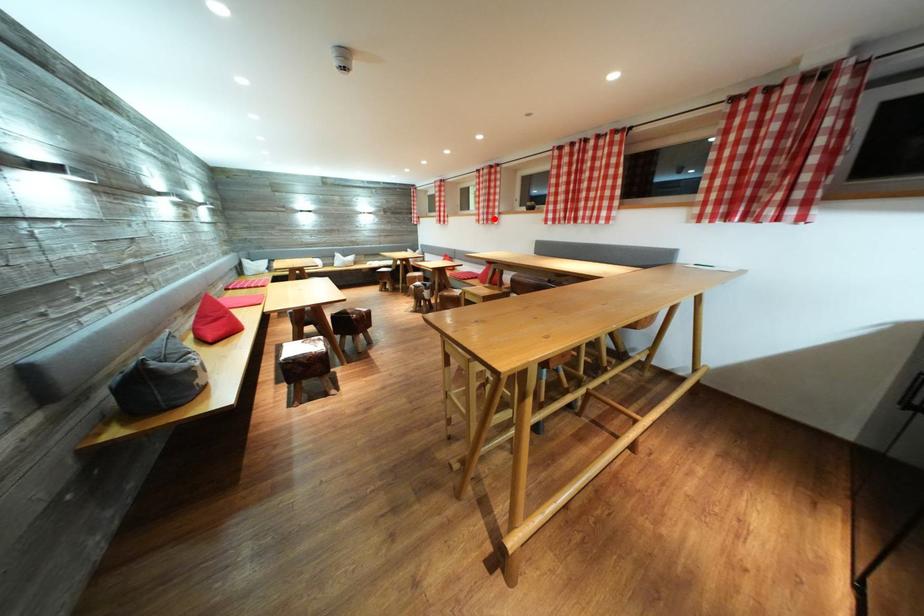
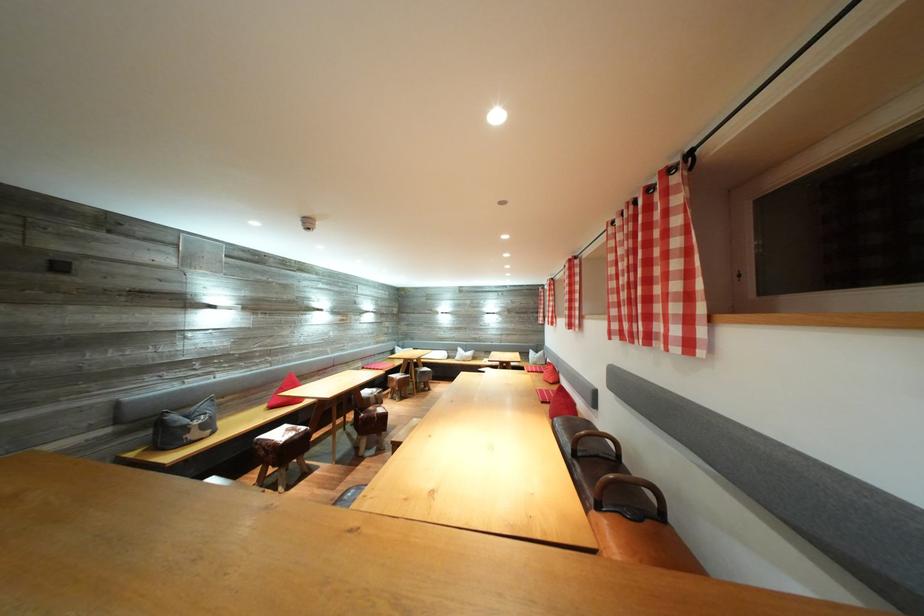
Where in the second image is the point corresponding to the highlighted location from the first image?

(578, 322)